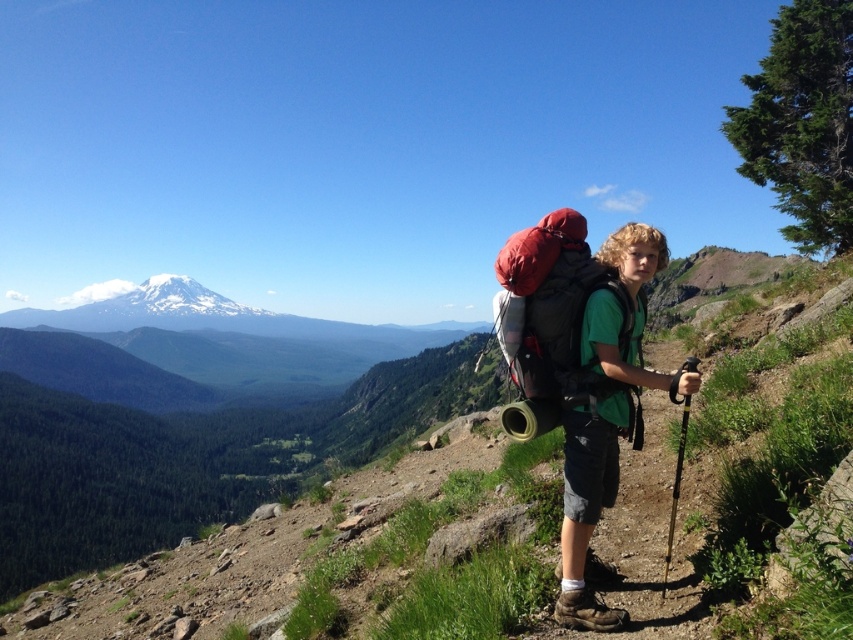
In the scene shown: You are a hiker who wants to take a photo of the snowcapped mountain in the background. You have a green fabric backpack at center and a matte red backpack at center. Which backpack should you move to ensure the mountain is fully visible in your photo?

The green fabric backpack at center is in front of the matte red backpack at center. To ensure the snowcapped mountain in the background is fully visible, you should move the green fabric backpack at center out of the way.